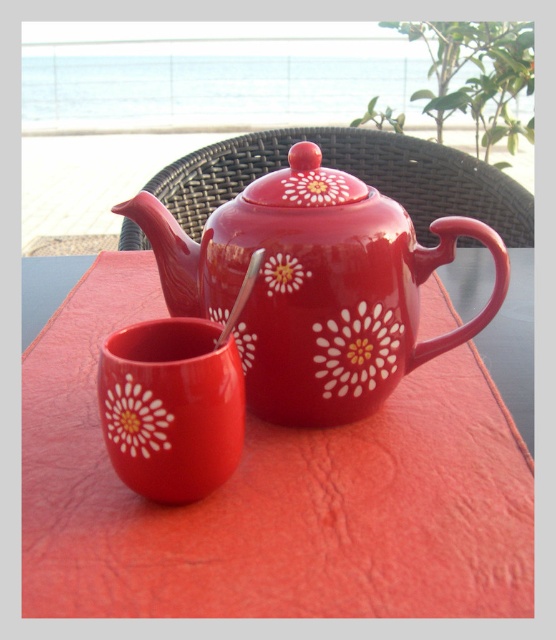
Question: Considering the real-world distances, which object is closest to the glossy ceramic table at center?

Choices:
 (A) matte ceramic mug at lower left
 (B) matte ceramic teapot at center

Answer: (B)

Question: Does glossy ceramic table at center appear over matte ceramic teapot at center?

Choices:
 (A) yes
 (B) no

Answer: (B)

Question: Which of these objects is positioned farthest from the matte ceramic mug at lower left?

Choices:
 (A) matte ceramic teapot at center
 (B) glossy ceramic table at center

Answer: (B)

Question: Can you confirm if glossy ceramic table at center is bigger than matte ceramic teapot at center?

Choices:
 (A) no
 (B) yes

Answer: (B)

Question: Can you confirm if glossy ceramic table at center is smaller than matte ceramic mug at lower left?

Choices:
 (A) yes
 (B) no

Answer: (B)

Question: Estimate the real-world distances between objects in this image. Which object is farther from the glossy ceramic table at center?

Choices:
 (A) matte ceramic teapot at center
 (B) matte ceramic mug at lower left

Answer: (B)